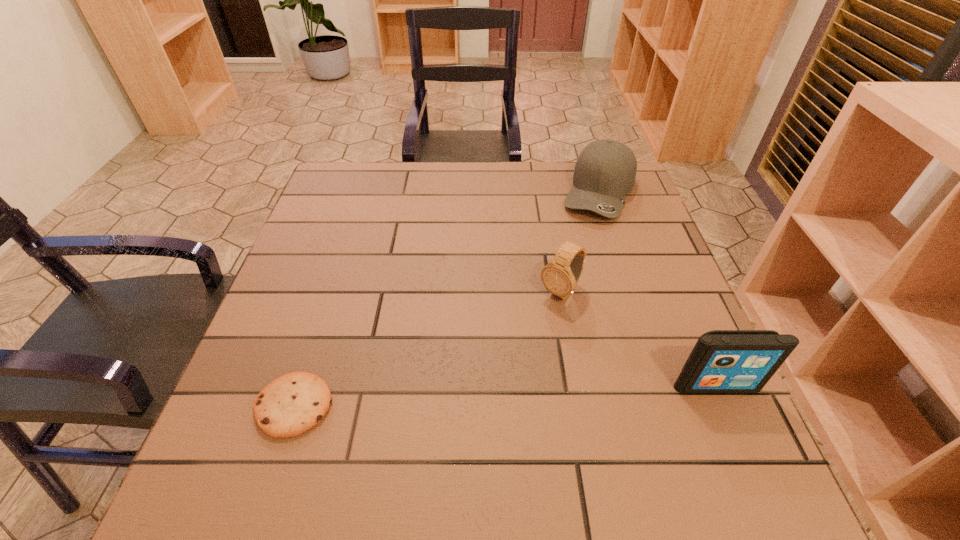
Locate an element on the screen. object that is positioned at the far right corner is located at coordinates (605, 171).

Identify the location of vacant region at the far edge. This screenshot has width=960, height=540. (376, 205).

In the image, there is a desktop. Identify the location of vacant space at the near edge. The width and height of the screenshot is (960, 540). (638, 406).

In the image, there is a desktop. Identify the location of vacant space at the left edge. (276, 313).

Locate an element on the screen. This screenshot has height=540, width=960. vacant area at the right edge is located at coordinates (611, 245).

At what (x,y) coordinates should I click in order to perform the action: click on vacant region at the far left corner. Please return your answer as a coordinate pair (x, y). The width and height of the screenshot is (960, 540). Looking at the image, I should click on (359, 200).

Locate an element on the screen. The width and height of the screenshot is (960, 540). vacant space that is in between the iPod and the farthest object is located at coordinates (658, 289).

Identify the location of free space between the iPod and the baseball cap. The height and width of the screenshot is (540, 960). (658, 289).

Locate an element on the screen. free space that is in between the watch and the baseball cap is located at coordinates (580, 242).

Locate an element on the screen. Image resolution: width=960 pixels, height=540 pixels. free spot between the baseball cap and the third nearest object is located at coordinates (580, 242).